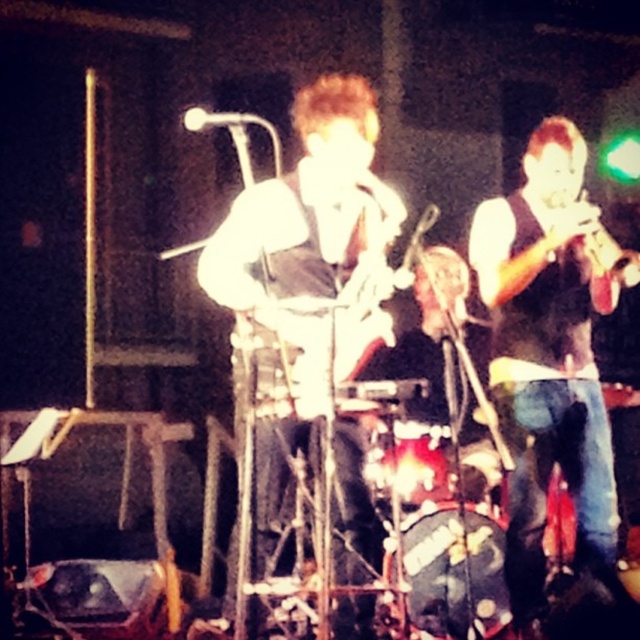
You are a photographer trying to capture the band members in the image. You notice two points marked in the scene. Which point is closer to your camera lens? The points are point at (x=524, y=568) and point at (x=337, y=464).

Point at (x=524, y=568) is closer to the camera lens because it is further to the viewer than point at (x=337, y=464).

You are a photographer at the live music performance and want to capture a photo of both the black matte vest at right and the shiny black guitar at center. Based on their positions, which object should you focus on first if you want to include both in the frame without moving the camera?

The black matte vest at right is positioned on the right side of the shiny black guitar at center, so you should focus on the shiny black guitar at center first as it is closer to the center of the frame, allowing both objects to be included without moving the camera.

You are a photographer at a live music performance. You need to position yourself so that both the white matte guitar at center and the shiny black guitar at center are in your shot. Which guitar should you place on the left side of your frame to ensure both are visible?

You should place the shiny black guitar at center on the left side of your frame because the white matte guitar at center is to the right of it, ensuring both guitars are visible in the shot.